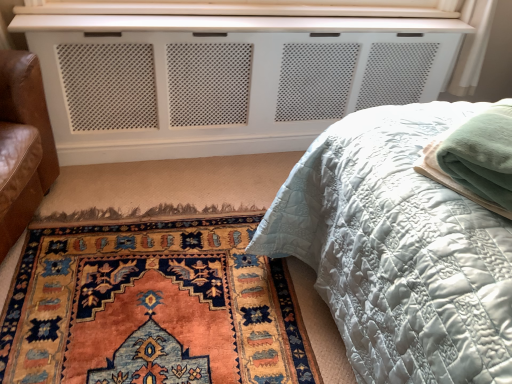
What do you see at coordinates (227, 76) in the screenshot? This screenshot has width=512, height=384. I see `white perforated panel at upper center` at bounding box center [227, 76].

Where is `white perforated panel at upper center`? Image resolution: width=512 pixels, height=384 pixels. white perforated panel at upper center is located at coordinates (227, 76).

Where is `white perforated panel at upper center`? white perforated panel at upper center is located at coordinates (227, 76).

Is there a large distance between matte white quilted bed at center and white perforated panel at upper center?

That's right, there is a large distance between matte white quilted bed at center and white perforated panel at upper center.

This screenshot has height=384, width=512. What are the coordinates of `vanity on the left of matte white quilted bed at center` in the screenshot? It's located at (227, 76).

Can you tell me how much matte white quilted bed at center and white perforated panel at upper center differ in facing direction?

The angular difference between matte white quilted bed at center and white perforated panel at upper center is 90.7 degrees.

Does matte white quilted bed at center turn towards white perforated panel at upper center?

No, matte white quilted bed at center does not turn towards white perforated panel at upper center.

Is green fleece blanket at right facing towards white perforated panel at upper center?

No, green fleece blanket at right is not facing towards white perforated panel at upper center.

I want to click on material below the white perforated panel at upper center (from the image's perspective), so click(x=482, y=155).

Between point (460, 175) and point (247, 75), which one is positioned in front?

The point (460, 175) is in front.

From the image's perspective, is green fleece blanket at right under white perforated panel at upper center?

Yes.

From a real-world perspective, which object rests below the other?

matte white quilted bed at center is physically lower.

Which of these two, green fleece blanket at right or matte white quilted bed at center, is wider?

With larger width is matte white quilted bed at center.

From the picture: Is green fleece blanket at right facing away from matte white quilted bed at center?

Yes.

Looking at this image, from the image's perspective, which is below, green fleece blanket at right or matte white quilted bed at center?

matte white quilted bed at center is shown below in the image.

From the image's perspective, would you say matte white quilted bed at center is positioned over green fleece blanket at right?

Actually, matte white quilted bed at center appears below green fleece blanket at right in the image.

Which of these two, matte white quilted bed at center or green fleece blanket at right, is wider?

With larger width is matte white quilted bed at center.

Looking at this image, from a real-world perspective, between matte white quilted bed at center and green fleece blanket at right, who is vertically lower?

In real-world perspective, matte white quilted bed at center is lower.

Which object is closer to the camera, matte white quilted bed at center or green fleece blanket at right?

matte white quilted bed at center is more forward.

Is white perforated panel at upper center aimed at matte white quilted bed at center?

Yes.

The image size is (512, 384). What are the coordinates of `bed below the white perforated panel at upper center (from the image's perspective)` in the screenshot? It's located at pos(398,250).

Can you confirm if white perforated panel at upper center is wider than matte white quilted bed at center?

Incorrect, the width of white perforated panel at upper center does not surpass that of matte white quilted bed at center.

Between white perforated panel at upper center and matte white quilted bed at center, which one is positioned behind?

Positioned behind is white perforated panel at upper center.

Which is correct: white perforated panel at upper center is inside carpet with intricate patterns at lower left, or outside of it?

white perforated panel at upper center is outside carpet with intricate patterns at lower left.

Considering the sizes of white perforated panel at upper center and carpet with intricate patterns at lower left in the image, is white perforated panel at upper center taller or shorter than carpet with intricate patterns at lower left?

white perforated panel at upper center is taller than carpet with intricate patterns at lower left.

How distant is white perforated panel at upper center from carpet with intricate patterns at lower left?

They are 33.74 inches apart.

From a real-world perspective, is white perforated panel at upper center positioned over carpet with intricate patterns at lower left based on gravity?

Yes.

Based on the photo, which of these two, carpet with intricate patterns at lower left or green fleece blanket at right, stands shorter?

carpet with intricate patterns at lower left.

Which object is thinner, carpet with intricate patterns at lower left or green fleece blanket at right?

green fleece blanket at right.

Is carpet with intricate patterns at lower left not near green fleece blanket at right?

Yes.

Where is `vanity lying behind the matte white quilted bed at center`? This screenshot has width=512, height=384. vanity lying behind the matte white quilted bed at center is located at coordinates (227, 76).

There is a white perforated panel at upper center. At what (x,y) coordinates should I click in order to perform the action: click on material above it (from a real-world perspective). Please return your answer as a coordinate pair (x, y). This screenshot has width=512, height=384. Looking at the image, I should click on (482, 155).

In the scene shown: Which object lies further to the anchor point green fleece blanket at right, white perforated panel at upper center or matte white quilted bed at center?

white perforated panel at upper center lies further to green fleece blanket at right than the other object.

When comparing their distances from carpet with intricate patterns at lower left, does green fleece blanket at right or matte white quilted bed at center seem further?

Based on the image, green fleece blanket at right appears to be further to carpet with intricate patterns at lower left.

When comparing their distances from green fleece blanket at right, does carpet with intricate patterns at lower left or matte white quilted bed at center seem closer?

matte white quilted bed at center is closer to green fleece blanket at right.

When comparing their distances from white perforated panel at upper center, does matte white quilted bed at center or green fleece blanket at right seem closer?

matte white quilted bed at center lies closer to white perforated panel at upper center than the other object.

When comparing their distances from green fleece blanket at right, does matte white quilted bed at center or white perforated panel at upper center seem closer?

Based on the image, matte white quilted bed at center appears to be nearer to green fleece blanket at right.

Which object lies further to the anchor point carpet with intricate patterns at lower left, white perforated panel at upper center or green fleece blanket at right?

green fleece blanket at right is further to carpet with intricate patterns at lower left.

When comparing their distances from white perforated panel at upper center, does carpet with intricate patterns at lower left or green fleece blanket at right seem closer?

carpet with intricate patterns at lower left is closer to white perforated panel at upper center.

From the image, which object appears to be farther from white perforated panel at upper center, green fleece blanket at right or carpet with intricate patterns at lower left?

green fleece blanket at right lies further to white perforated panel at upper center than the other object.

Identify the location of vanity situated between carpet with intricate patterns at lower left and green fleece blanket at right from left to right. The height and width of the screenshot is (384, 512). (227, 76).

This screenshot has width=512, height=384. Find the location of `bed between carpet with intricate patterns at lower left and green fleece blanket at right from left to right`. bed between carpet with intricate patterns at lower left and green fleece blanket at right from left to right is located at coordinates tap(398, 250).

You are a GUI agent. You are given a task and a screenshot of the screen. Output one action in this format:
    pyautogui.click(x=<x>, y=<y>)
    Task: Click on the material between matte white quilted bed at center and white perforated panel at upper center from front to back
    This screenshot has height=384, width=512.
    Given the screenshot: What is the action you would take?
    pyautogui.click(x=482, y=155)

In order to click on mat between matte white quilted bed at center and white perforated panel at upper center from front to back in this screenshot , I will do `click(152, 307)`.